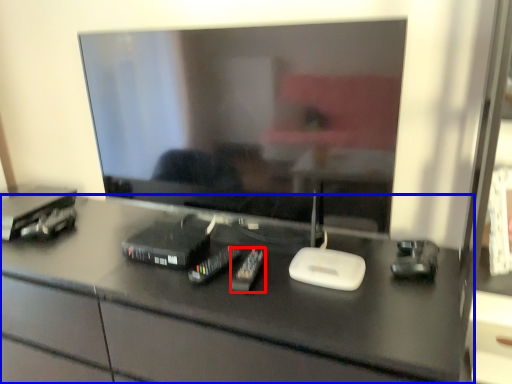
Question: Which object appears farthest to the camera in this image, equipment (highlighted by a red box) or desk (highlighted by a blue box)?

Choices:
 (A) equipment
 (B) desk

Answer: (A)